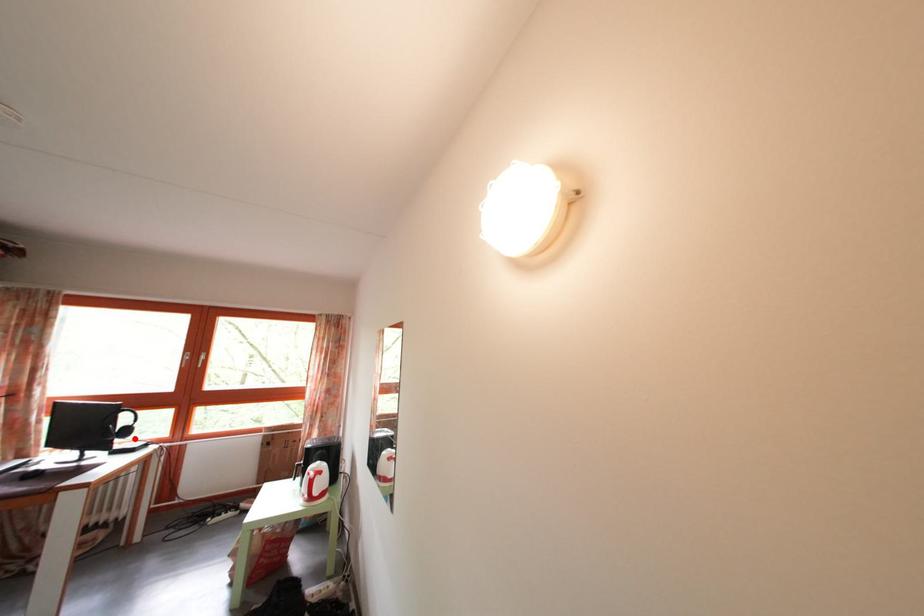
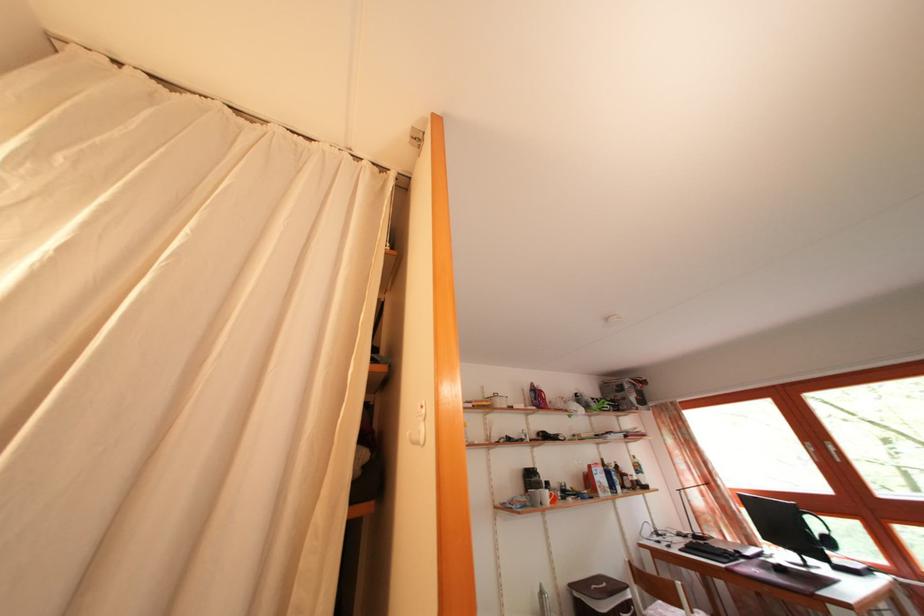
Question: A red point is marked in image1. In image2, is the corresponding 3D point closer to the camera or farther? Reply with the corresponding letter.

Choices:
 (A) The corresponding 3D point is closer.
 (B) The corresponding 3D point is farther.

Answer: (A)